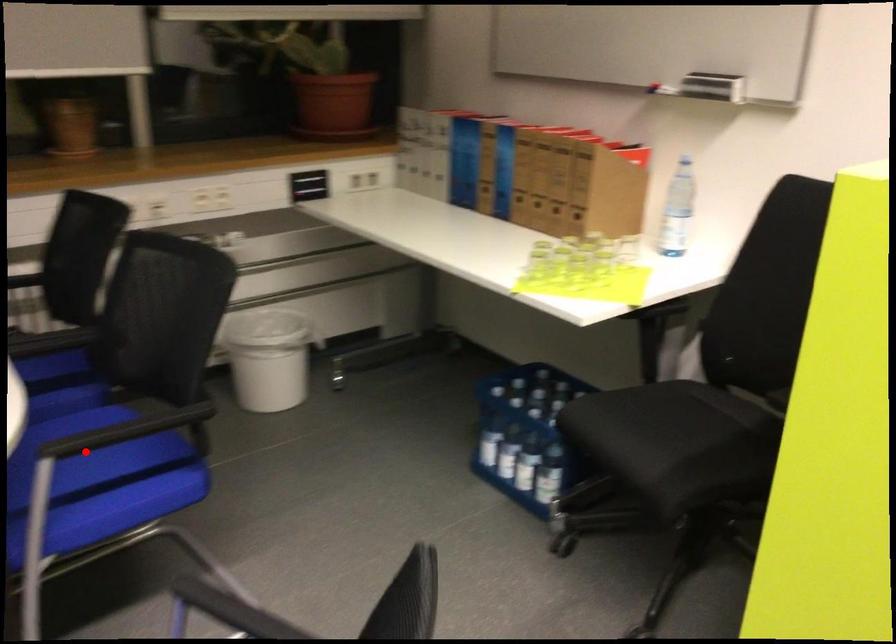
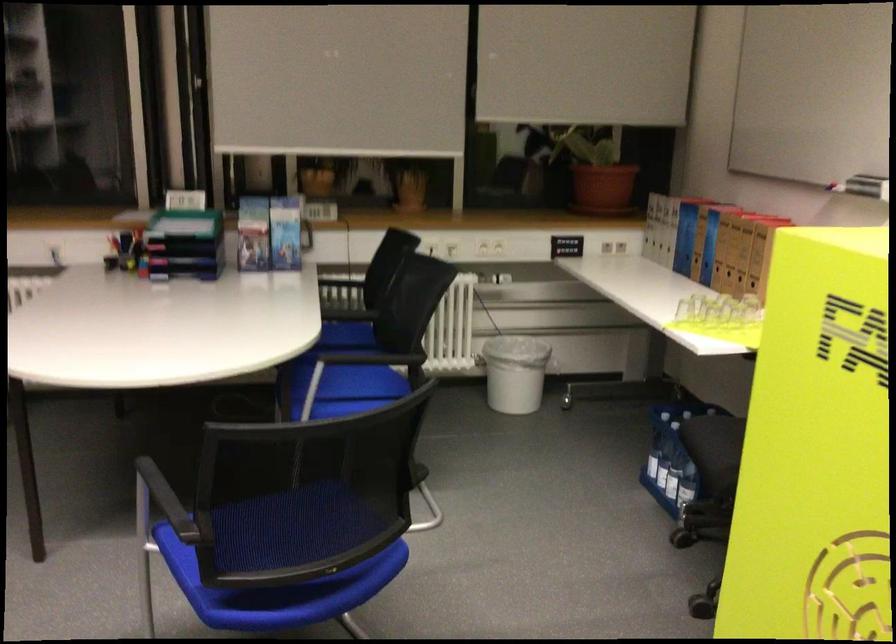
Question: I am providing you with two images of the same scene from different viewpoints. A red point is shown in image1. For the corresponding object point in image2, is it positioned nearer or farther from the camera?

Choices:
 (A) Nearer
 (B) Farther

Answer: (B)